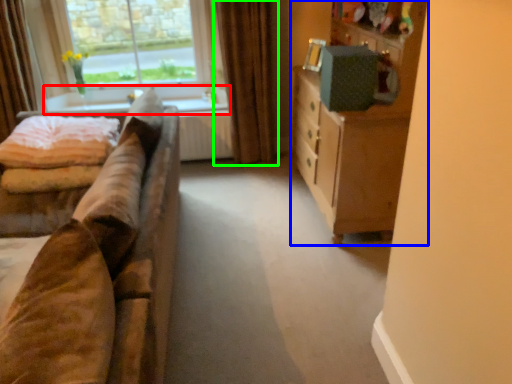
Question: Considering the real-world distances, which object is closest to window sill (highlighted by a red box)? cabinetry (highlighted by a blue box) or curtain (highlighted by a green box).

Choices:
 (A) cabinetry
 (B) curtain

Answer: (B)